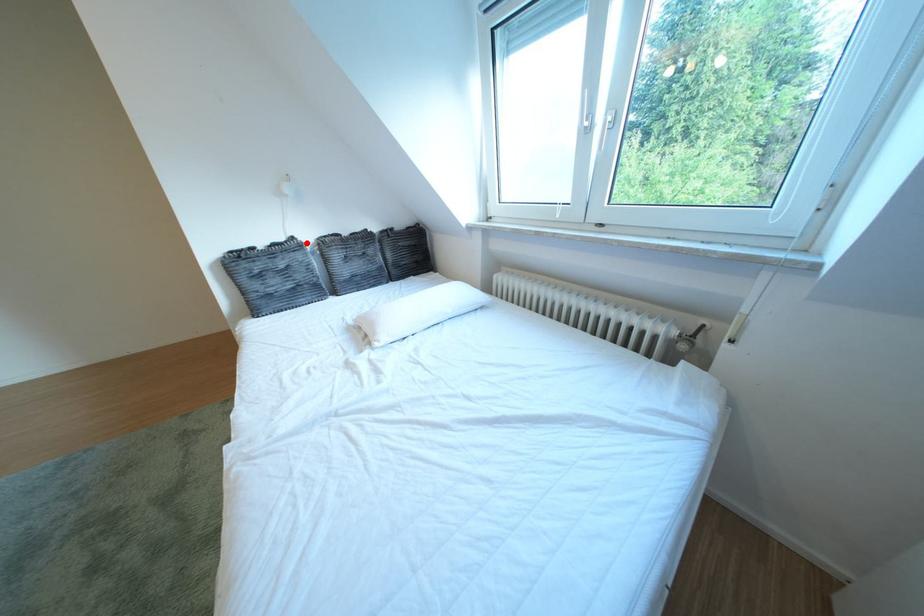
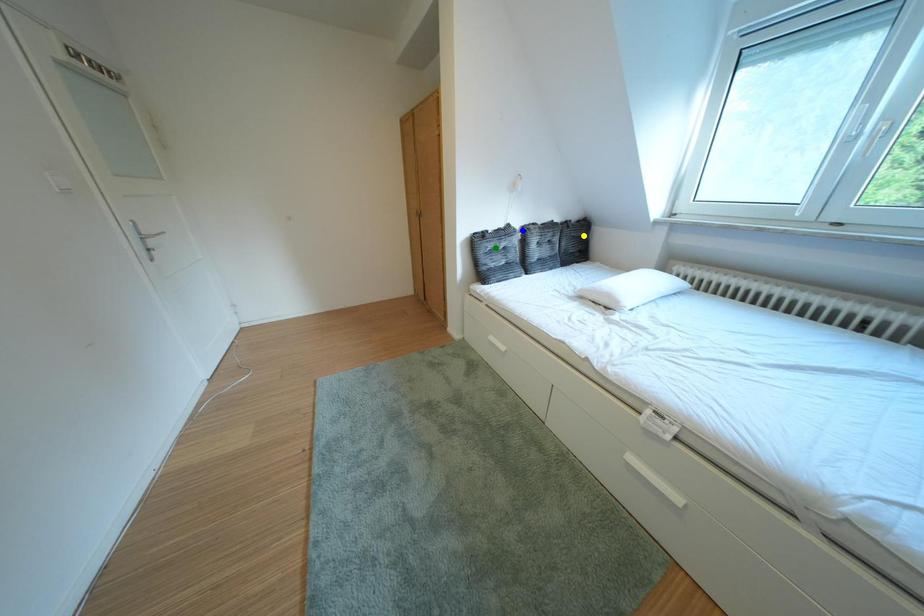
Question: I am providing you with two images of the same scene from different viewpoints. A red point is marked on the first image. You are given multiple points on the second image. Which spot in image 2 lines up with the point in image 1?

Choices:
 (A) green point
 (B) blue point
 (C) yellow point

Answer: (B)